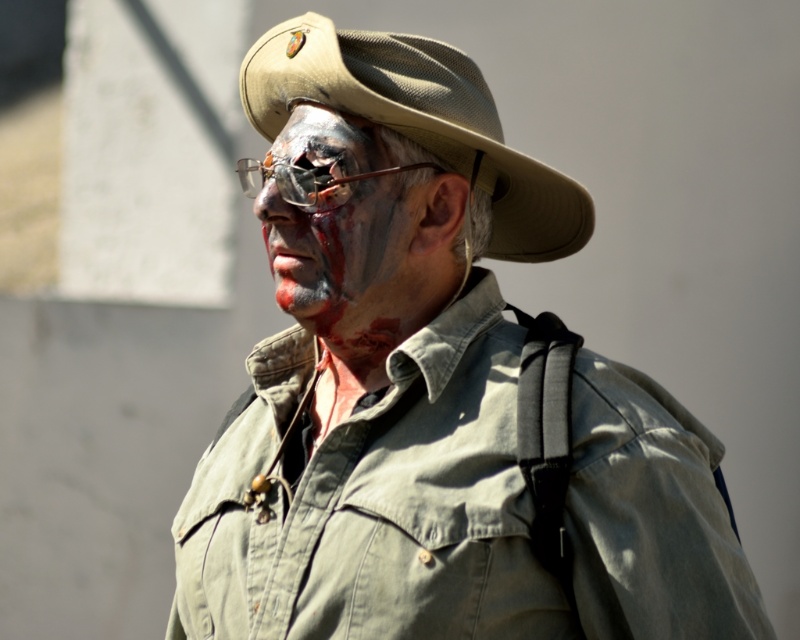
You are a photographer trying to capture the perfect shot of the tan fabric fedora at center. According to the coordinates provided, where should you position your camera to ensure the hat is centered in the frame?

The tan fabric fedora at center is located at coordinates point (418, 122), so positioning the camera to center the frame at those coordinates will ensure the hat is centered.

You are a photographer at the event and need to capture a clear shot of both the tan fabric fedora at center and the matte gray face at center. Which object should you focus on first to ensure both are in frame?

The tan fabric fedora at center is positioned on the right side of matte gray face at center, so you should focus on the matte gray face at center first to ensure both are in frame.

Based on the scene description, can you determine if the tan fabric fedora at center is wider than the matte gray face at center?

The tan fabric fedora at center might be wider than matte gray face at center according to the description.